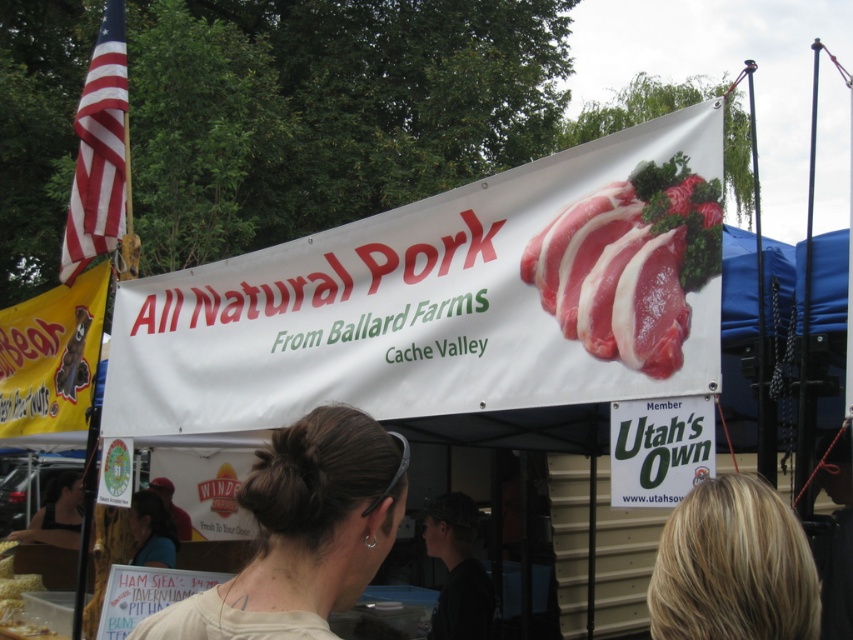
Question: Can you confirm if light beige fabric at center is thinner than blonde hair at upper center?

Choices:
 (A) yes
 (B) no

Answer: (B)

Question: Estimate the real-world distances between objects in this image. Which object is closer to the raw pink meat at center?

Choices:
 (A) light beige fabric at center
 (B) matte brown hair at lower left
 (C) blonde hair at upper center

Answer: (C)

Question: Is raw pink meat at center below blonde hair at upper center?

Choices:
 (A) no
 (B) yes

Answer: (A)

Question: Is light beige fabric at center above blonde hair at upper center?

Choices:
 (A) no
 (B) yes

Answer: (B)

Question: Which of these objects is positioned farthest from the matte brown hair at lower left?

Choices:
 (A) raw pink meat at center
 (B) light beige fabric at center
 (C) blonde hair at upper center

Answer: (C)

Question: Which of the following is the closest to the observer?

Choices:
 (A) (697, 275)
 (B) (793, 625)
 (C) (285, 609)
 (D) (154, 564)

Answer: (B)